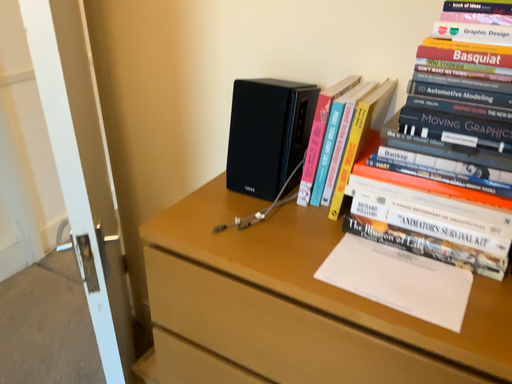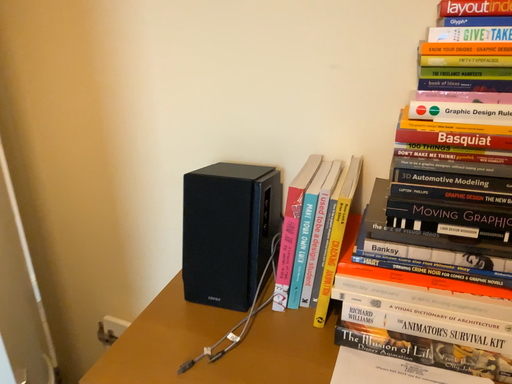
Question: How did the camera likely rotate when shooting the video?

Choices:
 (A) rotated right
 (B) rotated left

Answer: (A)